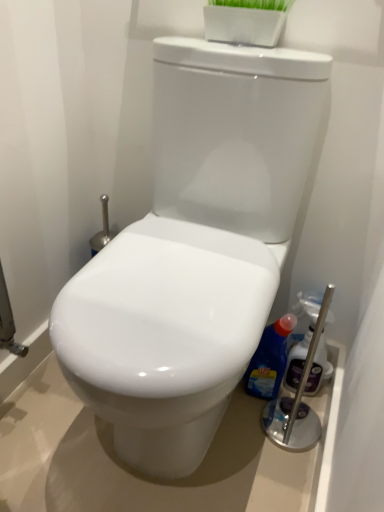
Question: In terms of width, does blue glossy bottle at right, placed as the 2th cleaning product when sorted from right to left, look wider or thinner when compared to white glossy toilet at center?

Choices:
 (A) wide
 (B) thin

Answer: (B)

Question: From their relative heights in the image, would you say blue glossy bottle at right, positioned as the first cleaning product in left-to-right order, is taller or shorter than white glossy toilet at center?

Choices:
 (A) tall
 (B) short

Answer: (B)

Question: Estimate the real-world distances between objects in this image. Which object is farther from the blue glossy bottle at right, placed as the 2th cleaning product when sorted from right to left?

Choices:
 (A) translucent plastic spray bottle at right, which is counted as the first cleaning product, starting from the right
 (B) white glossy toilet at center

Answer: (B)

Question: Estimate the real-world distances between objects in this image. Which object is farther from the white glossy toilet at center?

Choices:
 (A) translucent plastic spray bottle at right, the second cleaning product in the left-to-right sequence
 (B) blue glossy bottle at right, positioned as the first cleaning product in left-to-right order

Answer: (A)